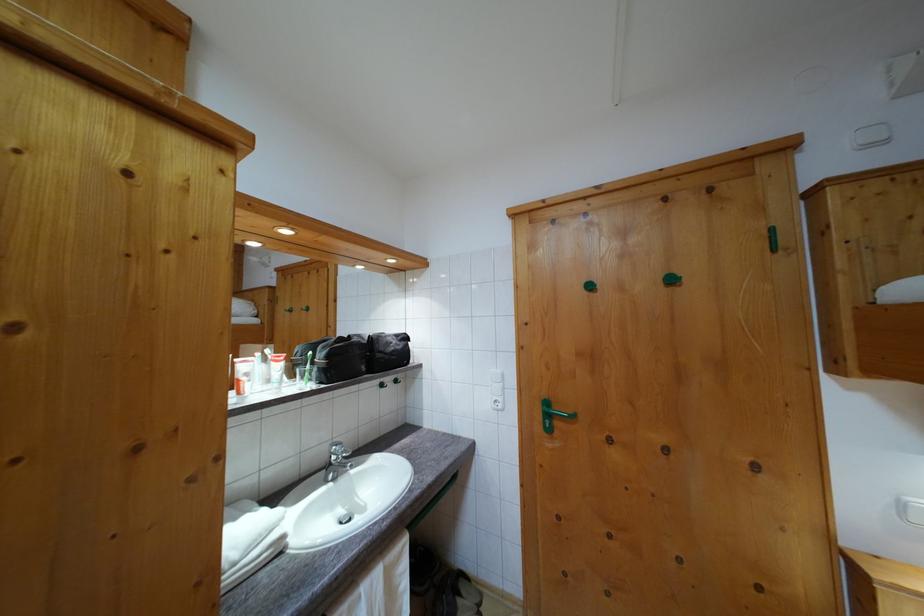
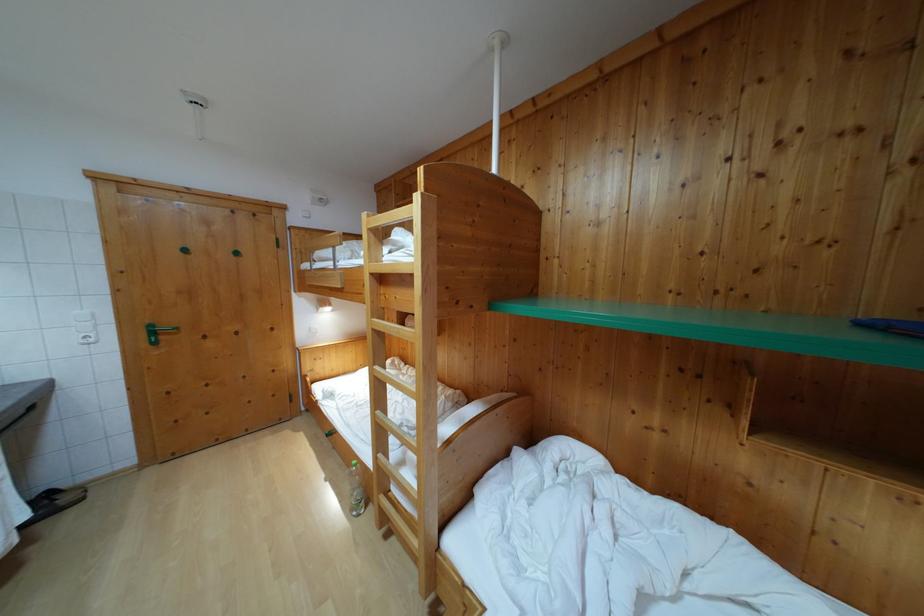
Locate, in the second image, the point that corresponds to pixel 551 410 in the first image.

(155, 333)